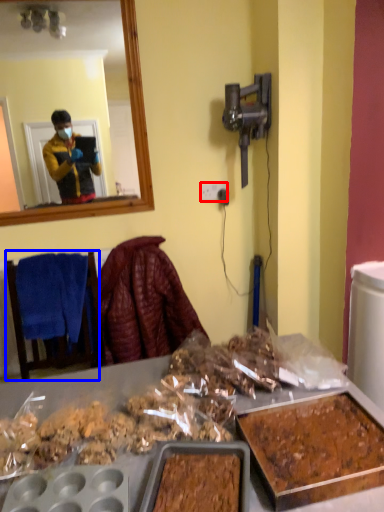
Question: Which of the following is the closest to the observer, power outlet (highlighted by a red box) or furniture (highlighted by a blue box)?

Choices:
 (A) power outlet
 (B) furniture

Answer: (B)